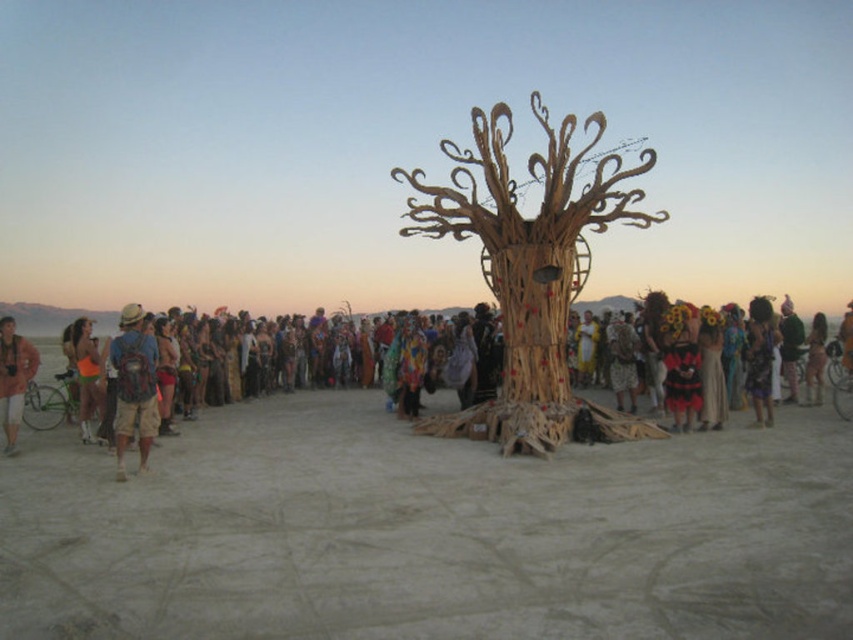
You are at the desert festival and see two backpacks, the matte blue backpack at left and the matte brown backpack at left. Which one is closer to the ground?

The matte blue backpack at left is closer to the ground because it is positioned under the matte brown backpack at left.

You are at the desert festival and want to carry both the matte blue backpack at left and the matte brown backpack at left. Which backpack can you place inside the other?

The matte blue backpack at left has a smaller width than the matte brown backpack at left, so the matte blue backpack at left can be placed inside the matte brown backpack at left.